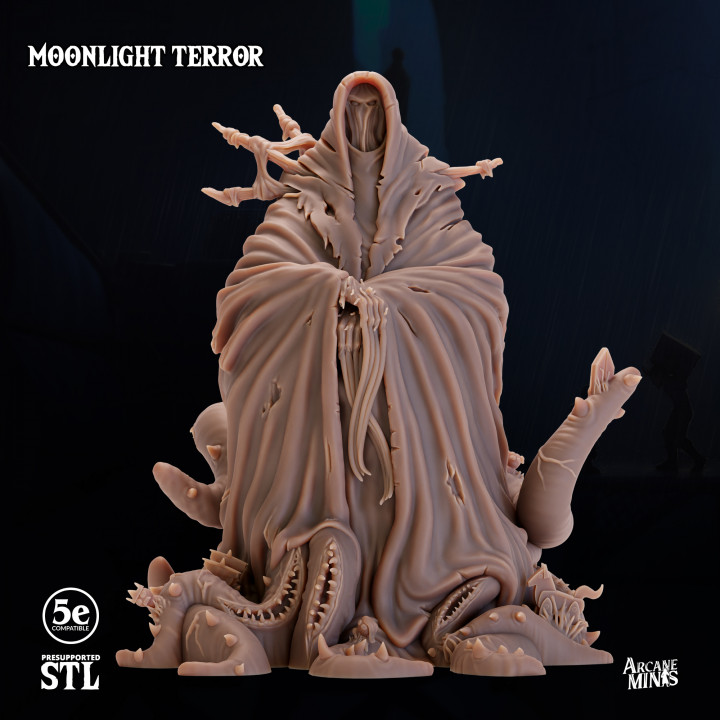
This screenshot has width=720, height=720. Find the location of `hobby horse`. hobby horse is located at coordinates (541, 580), (558, 595), (594, 636), (589, 589).